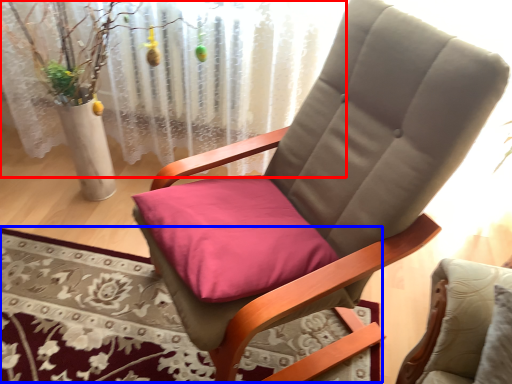
Question: Which point is further to the camera, curtain (highlighted by a red box) or mat (highlighted by a blue box)?

Choices:
 (A) curtain
 (B) mat

Answer: (A)